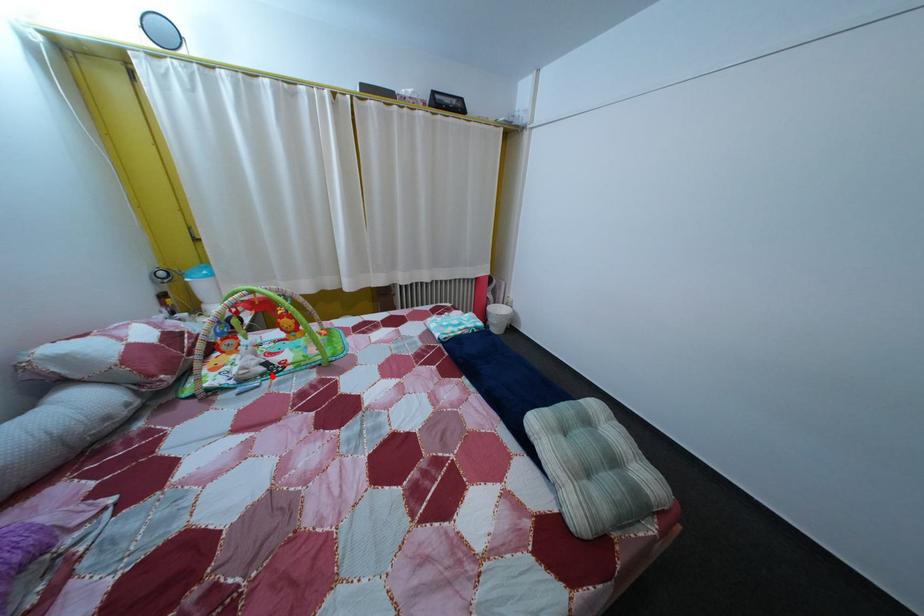
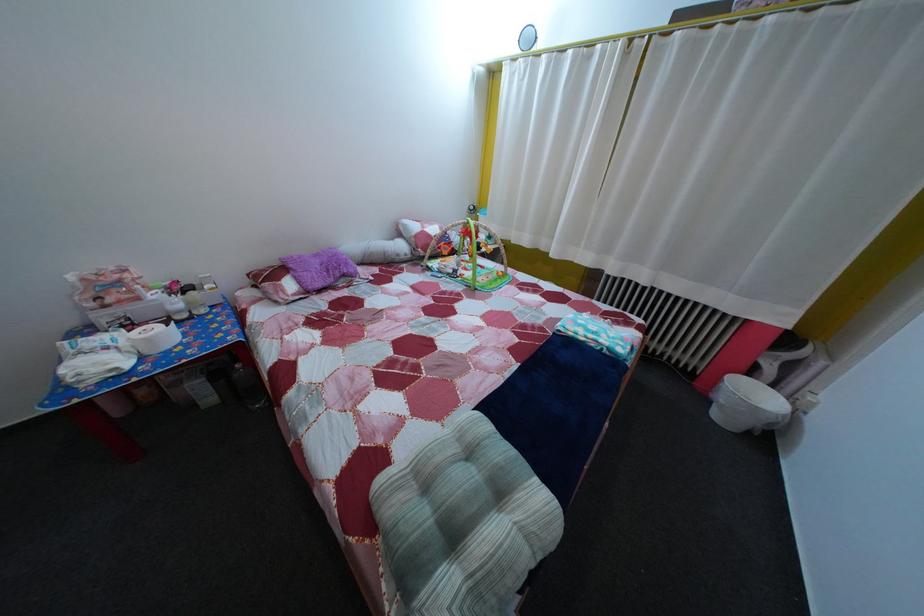
Locate, in the second image, the point that corresponds to the highlighted location in the first image.

(459, 278)